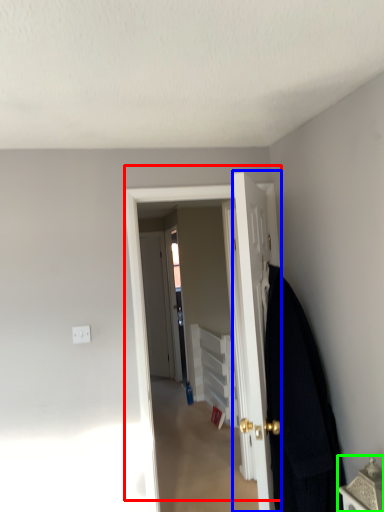
Question: Considering the real-world distances, which object is farthest from door (highlighted by a red box)? door (highlighted by a blue box) or furniture (highlighted by a green box)?

Choices:
 (A) door
 (B) furniture

Answer: (B)